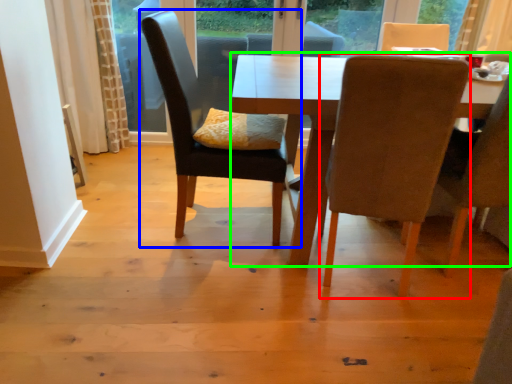
Question: Which is farther away from chair (highlighted by a red box)? chair (highlighted by a blue box) or kitchen & dining room table (highlighted by a green box)?

Choices:
 (A) chair
 (B) kitchen & dining room table

Answer: (A)